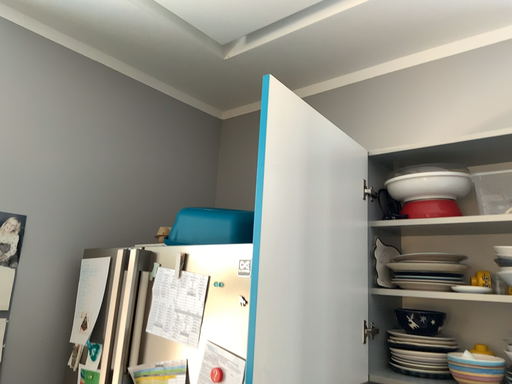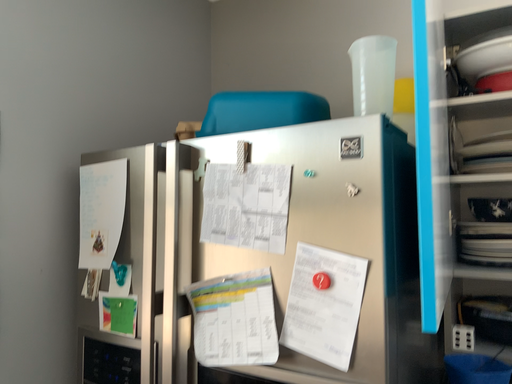
Question: Which way did the camera rotate in the video?

Choices:
 (A) rotated right
 (B) rotated left

Answer: (A)